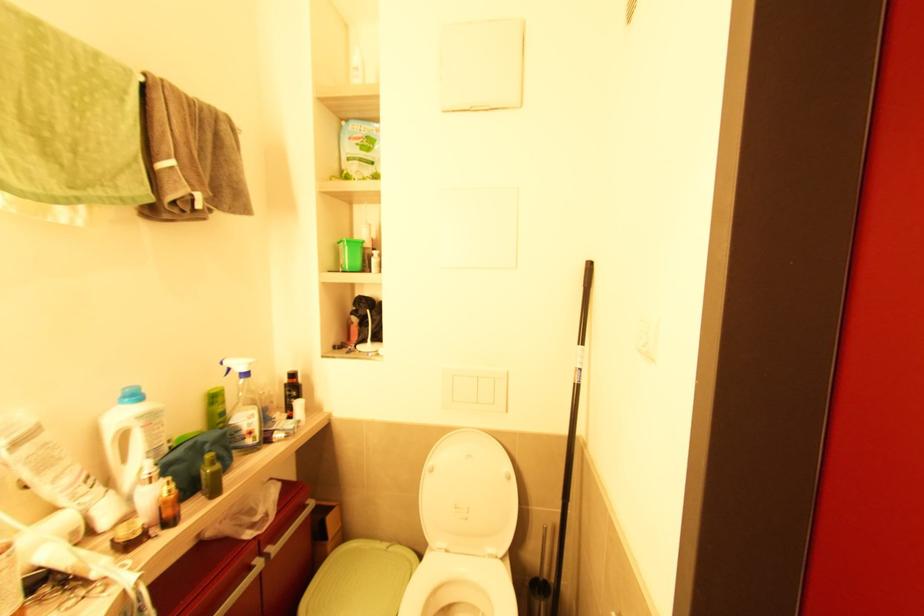
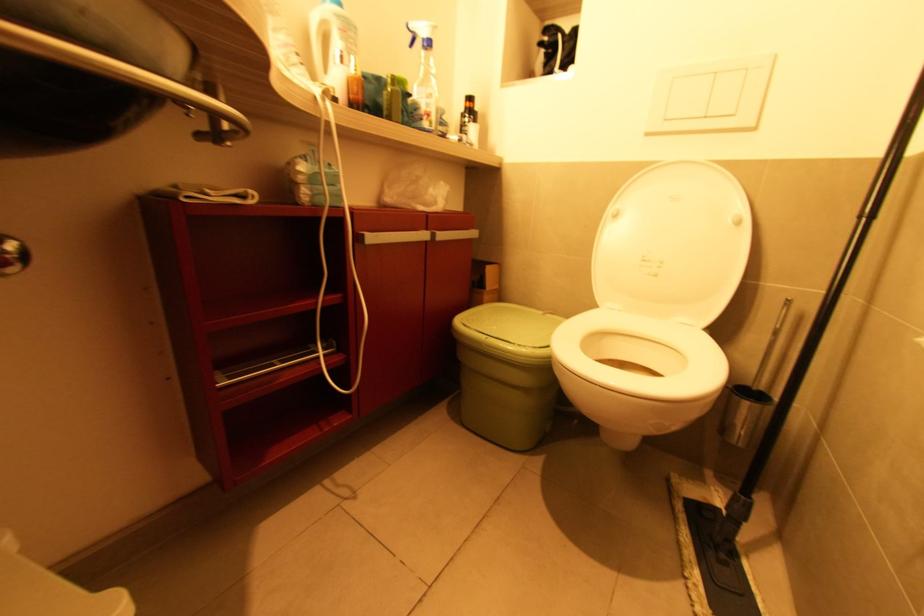
The point at [388,549] is marked in the first image. Where is the corresponding point in the second image?

(545, 314)